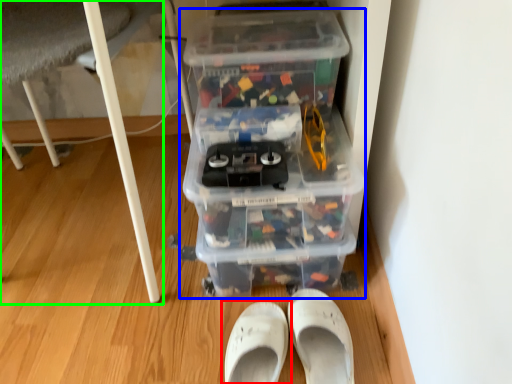
Question: Which object is positioned farthest from footwear (highlighted by a red box)? Select from storage box (highlighted by a blue box) and furniture (highlighted by a green box).

Choices:
 (A) storage box
 (B) furniture

Answer: (A)